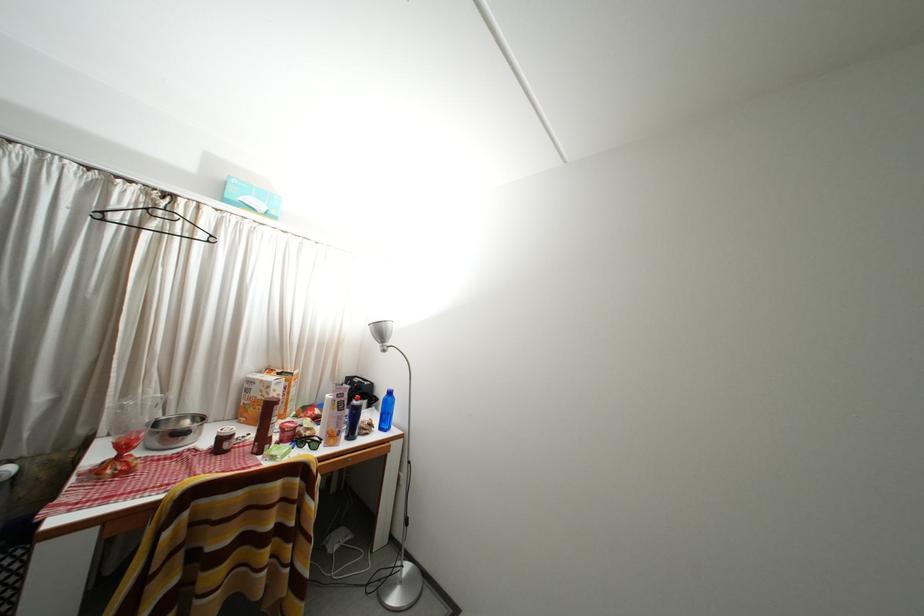
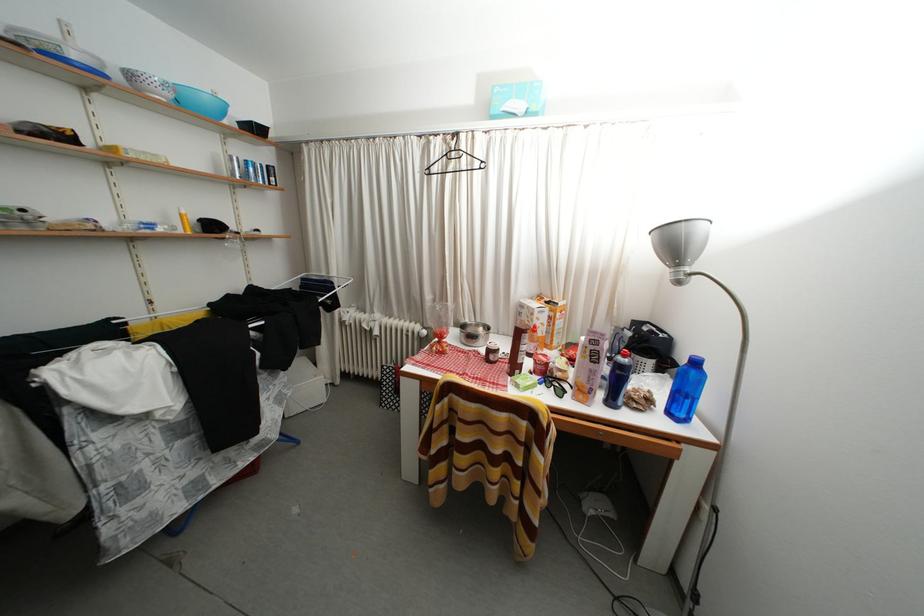
Question: I am providing you with two images of the same scene from different viewpoints. Which of the following objects are not visible in image2?

Choices:
 (A) orange juice carton
 (B) silver beverage can
 (C) white and blue colander
 (D) none of these

Answer: (D)